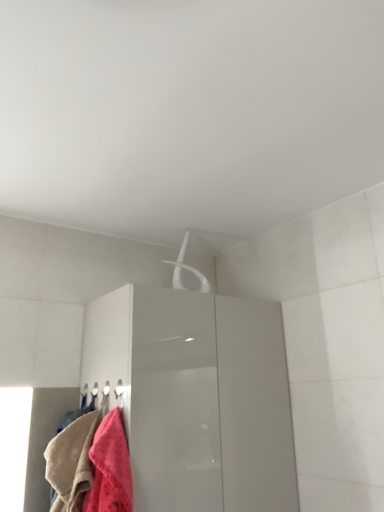
This screenshot has width=384, height=512. What do you see at coordinates (197, 397) in the screenshot? I see `glossy white cabinet at upper center` at bounding box center [197, 397].

Find the location of `glossy white cabinet at upper center`. glossy white cabinet at upper center is located at coordinates (197, 397).

In order to face glossy white cabinet at upper center, should I rotate leftwards or rightwards?

You should look left and rotate roughly 0.967 degrees.

Image resolution: width=384 pixels, height=512 pixels. Find the location of `fluffy pink towel at lower left`. fluffy pink towel at lower left is located at coordinates (71, 462).

What do you see at coordinates (71, 462) in the screenshot? I see `fluffy pink towel at lower left` at bounding box center [71, 462].

The height and width of the screenshot is (512, 384). Find the location of `glossy white cabinet at upper center`. glossy white cabinet at upper center is located at coordinates (197, 397).

Is glossy white cabinet at upper center to the left or to the right of fluffy pink towel at lower left in the image?

Clearly, glossy white cabinet at upper center is on the right of fluffy pink towel at lower left in the image.

Which object is more forward, glossy white cabinet at upper center or fluffy pink towel at lower left?

fluffy pink towel at lower left is more forward.

Is point (270, 371) positioned before point (80, 428)?

No, it is not.

From the image's perspective, is glossy white cabinet at upper center on top of fluffy pink towel at lower left?

Actually, glossy white cabinet at upper center appears below fluffy pink towel at lower left in the image.

From a real-world perspective, who is located lower, glossy white cabinet at upper center or fluffy pink towel at lower left?

In real-world perspective, fluffy pink towel at lower left is lower.

Does glossy white cabinet at upper center have a greater width compared to fluffy pink towel at lower left?

Correct, the width of glossy white cabinet at upper center exceeds that of fluffy pink towel at lower left.

Does glossy white cabinet at upper center have a greater height compared to fluffy pink towel at lower left?

Indeed, glossy white cabinet at upper center has a greater height compared to fluffy pink towel at lower left.

Between glossy white cabinet at upper center and fluffy pink towel at lower left, which one has larger size?

With larger size is glossy white cabinet at upper center.

Can fluffy pink towel at lower left be found inside glossy white cabinet at upper center?

No, fluffy pink towel at lower left is not a part of glossy white cabinet at upper center.

Is glossy white cabinet at upper center next to fluffy pink towel at lower left and touching it?

No, glossy white cabinet at upper center is not making contact with fluffy pink towel at lower left.

Is fluffy pink towel at lower left at the back of glossy white cabinet at upper center?

That's not correct — glossy white cabinet at upper center is not looking away from fluffy pink towel at lower left.

What's the angular difference between glossy white cabinet at upper center and fluffy pink towel at lower left's facing directions?

→ They differ by 88.9 degrees in their facing directions.

How much distance is there between glossy white cabinet at upper center and fluffy pink towel at lower left?

glossy white cabinet at upper center is 14.88 inches from fluffy pink towel at lower left.

I want to click on towel to the left of glossy white cabinet at upper center, so click(x=71, y=462).

Which is more to the left, fluffy pink towel at lower left or glossy white cabinet at upper center?

Positioned to the left is fluffy pink towel at lower left.

Considering the positions of objects fluffy pink towel at lower left and glossy white cabinet at upper center in the image provided, who is behind, fluffy pink towel at lower left or glossy white cabinet at upper center?

glossy white cabinet at upper center is further from the camera.

Considering the points (82, 487) and (212, 399), which point is in front, point (82, 487) or point (212, 399)?

The point (82, 487) is closer.

From the image's perspective, who appears lower, fluffy pink towel at lower left or glossy white cabinet at upper center?

glossy white cabinet at upper center, from the image's perspective.

From a real-world perspective, who is located higher, fluffy pink towel at lower left or glossy white cabinet at upper center?

glossy white cabinet at upper center, from a real-world perspective.

Considering the sizes of fluffy pink towel at lower left and glossy white cabinet at upper center in the image, is fluffy pink towel at lower left wider or thinner than glossy white cabinet at upper center?

Clearly, fluffy pink towel at lower left has less width compared to glossy white cabinet at upper center.

Who is taller, fluffy pink towel at lower left or glossy white cabinet at upper center?

Standing taller between the two is glossy white cabinet at upper center.

Between fluffy pink towel at lower left and glossy white cabinet at upper center, which one has larger size?

Bigger between the two is glossy white cabinet at upper center.

Would you say fluffy pink towel at lower left is outside glossy white cabinet at upper center?

Indeed, fluffy pink towel at lower left is completely outside glossy white cabinet at upper center.

Does fluffy pink towel at lower left touch glossy white cabinet at upper center?

No, fluffy pink towel at lower left is not next to glossy white cabinet at upper center.

Is fluffy pink towel at lower left oriented away from glossy white cabinet at upper center?

Yes, fluffy pink towel at lower left is facing away from glossy white cabinet at upper center.

Can you tell me how much fluffy pink towel at lower left and glossy white cabinet at upper center differ in facing direction?

88.9 degrees separate the facing orientations of fluffy pink towel at lower left and glossy white cabinet at upper center.

Locate an element on the screen. cabinetry located behind the fluffy pink towel at lower left is located at coordinates pos(197,397).

The width and height of the screenshot is (384, 512). Find the location of `cabinetry behind the fluffy pink towel at lower left`. cabinetry behind the fluffy pink towel at lower left is located at coordinates [x=197, y=397].

Locate an element on the screen. cabinetry positioned vertically above the fluffy pink towel at lower left (from a real-world perspective) is located at coordinates (197, 397).